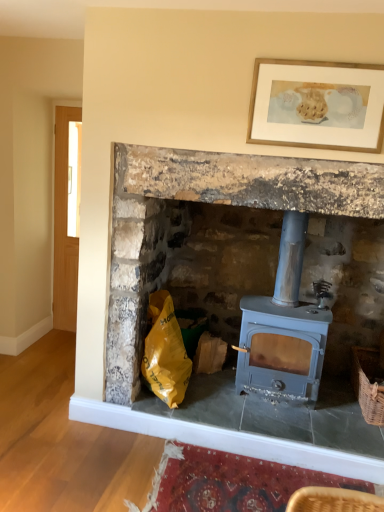
Question: Is matte gray wood stove at center to the left or to the right of woven brown basket at lower right in the image?

Choices:
 (A) left
 (B) right

Answer: (A)

Question: From a real-world perspective, is matte gray wood stove at center above or below woven brown basket at lower right?

Choices:
 (A) above
 (B) below

Answer: (A)

Question: Estimate the real-world distances between objects in this image. Which object is closer to the woven brown basket at lower right?

Choices:
 (A) matte gray wood stove at center
 (B) yellow plastic bag at lower left
 (C) matte blue wood burning stove at center
 (D) wooden-framed artwork at upper center

Answer: (C)

Question: Estimate the real-world distances between objects in this image. Which object is farther from the yellow plastic bag at lower left?

Choices:
 (A) woven brown basket at lower right
 (B) matte blue wood burning stove at center
 (C) matte gray wood stove at center
 (D) wooden-framed artwork at upper center

Answer: (D)